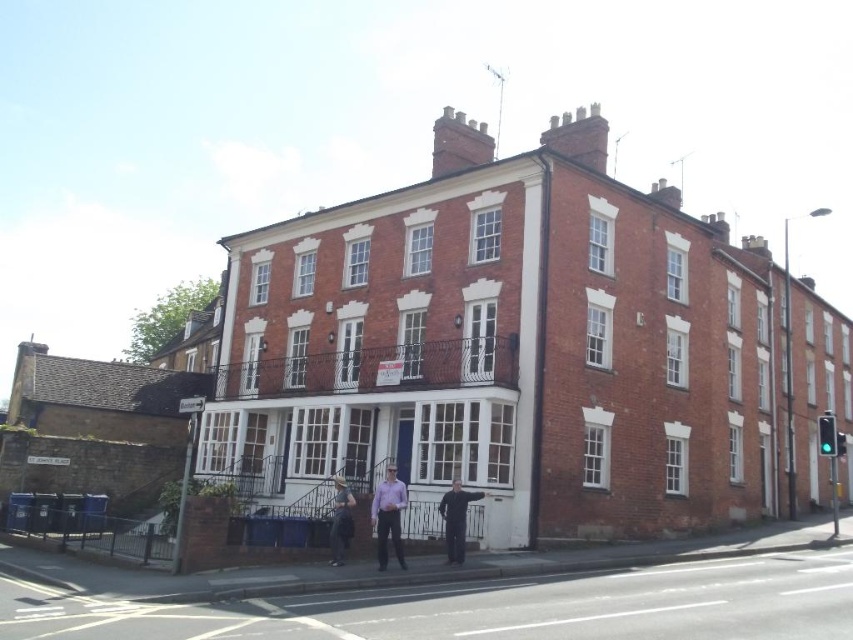
Question: Is purple cotton shirt at center above black matte suit at center?

Choices:
 (A) yes
 (B) no

Answer: (A)

Question: Which object appears farthest from the camera in this image?

Choices:
 (A) dark blue jeans at center
 (B) purple cotton shirt at center
 (C) black matte suit at center

Answer: (C)

Question: Which of these objects is positioned closest to the dark blue jeans at center?

Choices:
 (A) purple cotton shirt at center
 (B) black matte suit at center

Answer: (A)

Question: Which of the following is the farthest from the observer?

Choices:
 (A) black matte suit at center
 (B) purple cotton shirt at center
 (C) dark blue jeans at center

Answer: (A)

Question: Is purple cotton shirt at center to the left of black matte suit at center from the viewer's perspective?

Choices:
 (A) no
 (B) yes

Answer: (B)

Question: Is purple cotton shirt at center bigger than black matte suit at center?

Choices:
 (A) yes
 (B) no

Answer: (A)